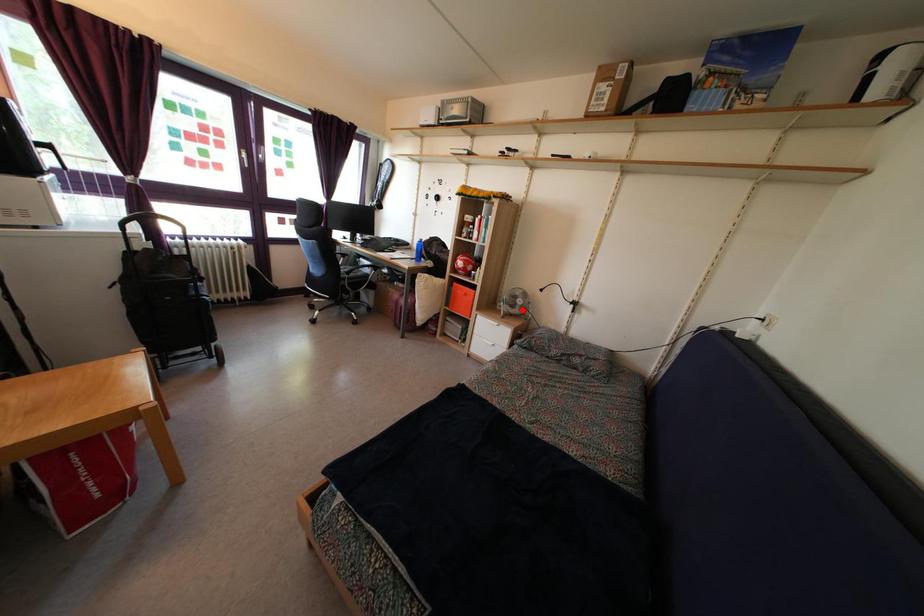
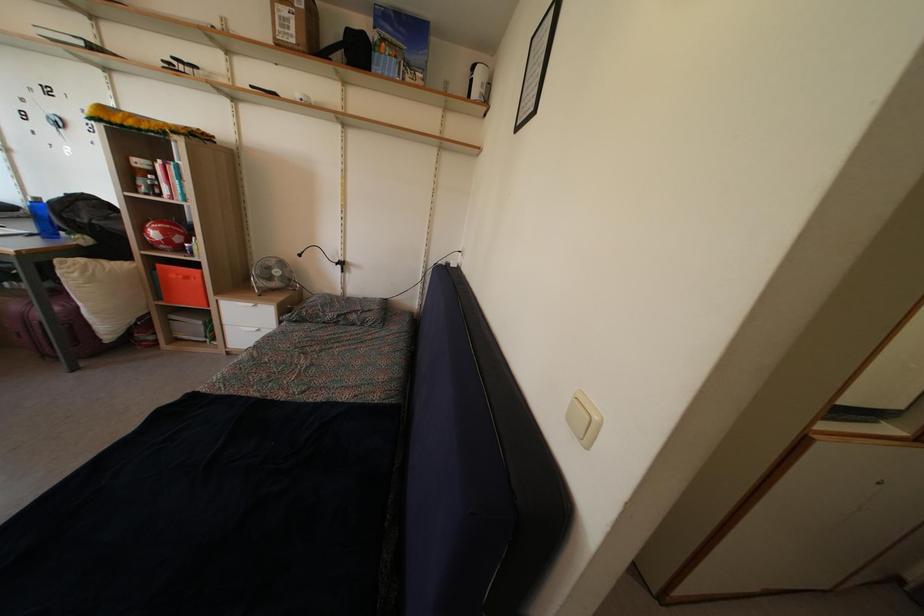
In the second image, find the point that corresponds to the highlighted location in the first image.

(280, 281)